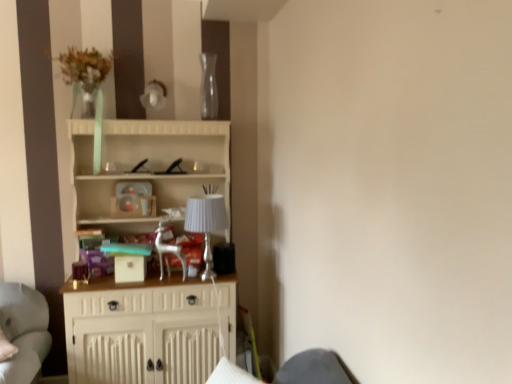
The width and height of the screenshot is (512, 384). I want to click on white wood cupboard at center, so click(146, 168).

Describe the element at coordinates (146, 168) in the screenshot. I see `white wood cupboard at center` at that location.

The width and height of the screenshot is (512, 384). What do you see at coordinates (206, 224) in the screenshot?
I see `silver metallic lamp at center` at bounding box center [206, 224].

What are the coordinates of `silver metallic lamp at center` in the screenshot? It's located at (206, 224).

I want to click on white wood cupboard at center, so click(146, 168).

Is white wood cupboard at center at the left side of silver metallic lamp at center?

Yes, white wood cupboard at center is to the left of silver metallic lamp at center.

Is the depth of white wood cupboard at center greater than that of silver metallic lamp at center?

No, white wood cupboard at center is in front of silver metallic lamp at center.

Is point (106, 146) positioned behind point (209, 228)?

Yes, it is behind point (209, 228).

From the image's perspective, between white wood cupboard at center and silver metallic lamp at center, which one is located above?

silver metallic lamp at center.

From a real-world perspective, between white wood cupboard at center and silver metallic lamp at center, who is vertically higher?

silver metallic lamp at center, from a real-world perspective.

In terms of width, does white wood cupboard at center look wider or thinner when compared to silver metallic lamp at center?

white wood cupboard at center is wider than silver metallic lamp at center.

Which of these two, white wood cupboard at center or silver metallic lamp at center, stands taller?

white wood cupboard at center.

Considering the relative sizes of white wood cupboard at center and silver metallic lamp at center in the image provided, is white wood cupboard at center bigger than silver metallic lamp at center?

Correct, white wood cupboard at center is larger in size than silver metallic lamp at center.

Is white wood cupboard at center spatially inside silver metallic lamp at center, or outside of it?

The correct answer is: outside.

Is white wood cupboard at center directly adjacent to silver metallic lamp at center?

white wood cupboard at center and silver metallic lamp at center are not in contact.

Based on the photo, is white wood cupboard at center oriented away from silver metallic lamp at center?

That's right, white wood cupboard at center is facing away from silver metallic lamp at center.

How different are the orientations of white wood cupboard at center and silver metallic lamp at center in degrees?

The angle between the facing direction of white wood cupboard at center and the facing direction of silver metallic lamp at center is 0.00025 degrees.

What are the coordinates of `lamp behind the white wood cupboard at center` in the screenshot? It's located at (206, 224).

Between silver metallic lamp at center and white wood cupboard at center, which one appears on the right side from the viewer's perspective?

From the viewer's perspective, silver metallic lamp at center appears more on the right side.

Is silver metallic lamp at center in front of white wood cupboard at center?

That is False.

Is point (213, 223) farther from camera compared to point (158, 171)?

No, (213, 223) is closer to viewer.

From the image's perspective, would you say silver metallic lamp at center is positioned over white wood cupboard at center?

Correct, silver metallic lamp at center appears higher than white wood cupboard at center in the image.

From a real-world perspective, is silver metallic lamp at center positioned above or below white wood cupboard at center?

In terms of real-world spatial position, silver metallic lamp at center is above white wood cupboard at center.

Considering the sizes of objects silver metallic lamp at center and white wood cupboard at center in the image provided, who is wider, silver metallic lamp at center or white wood cupboard at center?

Wider between the two is white wood cupboard at center.

Does silver metallic lamp at center have a lesser height compared to white wood cupboard at center?

Indeed, silver metallic lamp at center has a lesser height compared to white wood cupboard at center.

In terms of size, does silver metallic lamp at center appear bigger or smaller than white wood cupboard at center?

Considering their sizes, silver metallic lamp at center takes up less space than white wood cupboard at center.

Does silver metallic lamp at center contain white wood cupboard at center?

No, white wood cupboard at center is not inside silver metallic lamp at center.

Is silver metallic lamp at center touching white wood cupboard at center?

No, silver metallic lamp at center is not beside white wood cupboard at center.

Is silver metallic lamp at center looking in the opposite direction of white wood cupboard at center?

Correct, silver metallic lamp at center is looking away from white wood cupboard at center.

The image size is (512, 384). What are the coordinates of `lamp above the white wood cupboard at center (from a real-world perspective)` in the screenshot? It's located at point(206,224).

Locate an element on the screen. lamp above the white wood cupboard at center (from the image's perspective) is located at coordinates (206, 224).

Where is `cupboard in front of the silver metallic lamp at center`? The image size is (512, 384). cupboard in front of the silver metallic lamp at center is located at coordinates (146, 168).